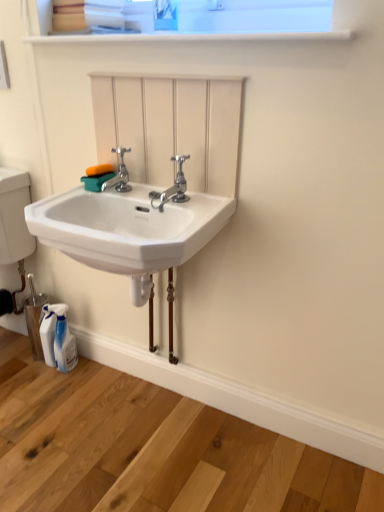
At what (x,y) coordinates should I click in order to perform the action: click on spots to the right of white glossy spray bottle at lower left. Please return your answer as a coordinate pair (x, y). Image resolution: width=384 pixels, height=512 pixels. Looking at the image, I should click on (97, 378).